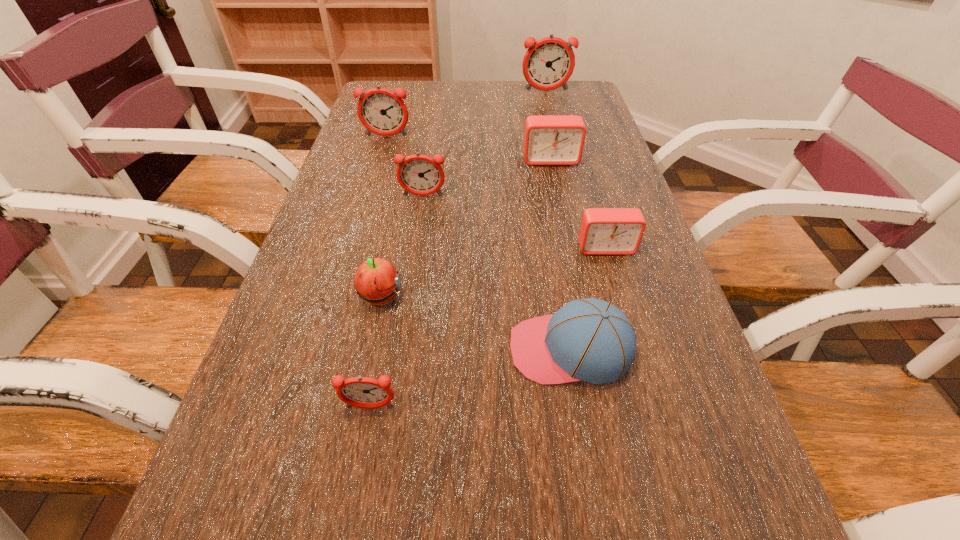
In the image, there is a desktop. Where is `vacant space at the right edge`? vacant space at the right edge is located at coordinates (637, 357).

In the image, there is a desktop. Where is `blank space at the far right corner`? The width and height of the screenshot is (960, 540). blank space at the far right corner is located at coordinates (556, 99).

Find the location of a particular element. This screenshot has height=540, width=960. free space between the apple and the baseball cap is located at coordinates (475, 323).

The height and width of the screenshot is (540, 960). In order to click on free space between the nearer red alarm clock and the seventh shortest object in this screenshot , I will do `click(496, 192)`.

At what (x,y) coordinates should I click in order to perform the action: click on vacant point located between the apple and the farther red alarm clock. Please return your answer as a coordinate pair (x, y). This screenshot has width=960, height=540. Looking at the image, I should click on (466, 229).

Image resolution: width=960 pixels, height=540 pixels. Find the location of `free space that is in between the second nearest alarm clock and the apple`. free space that is in between the second nearest alarm clock and the apple is located at coordinates (492, 273).

Identify the location of free space between the fourth nearest object and the sixth nearest object. This screenshot has width=960, height=540. (578, 204).

Where is `object that can be found as the fourth closest to the smallest reddish-pink alarm clock`? object that can be found as the fourth closest to the smallest reddish-pink alarm clock is located at coordinates (421, 175).

At what (x,y) coordinates should I click in order to perform the action: click on object identified as the fifth closest to the farthest object. Please return your answer as a coordinate pair (x, y). The height and width of the screenshot is (540, 960). Looking at the image, I should click on (376, 281).

Select which alarm clock appears as the closest to the fourth nearest alarm clock. Please provide its 2D coordinates. Your answer should be formatted as a tuple, i.e. [(x, y)], where the tuple contains the x and y coordinates of a point satisfying the conditions above.

[(421, 175)]